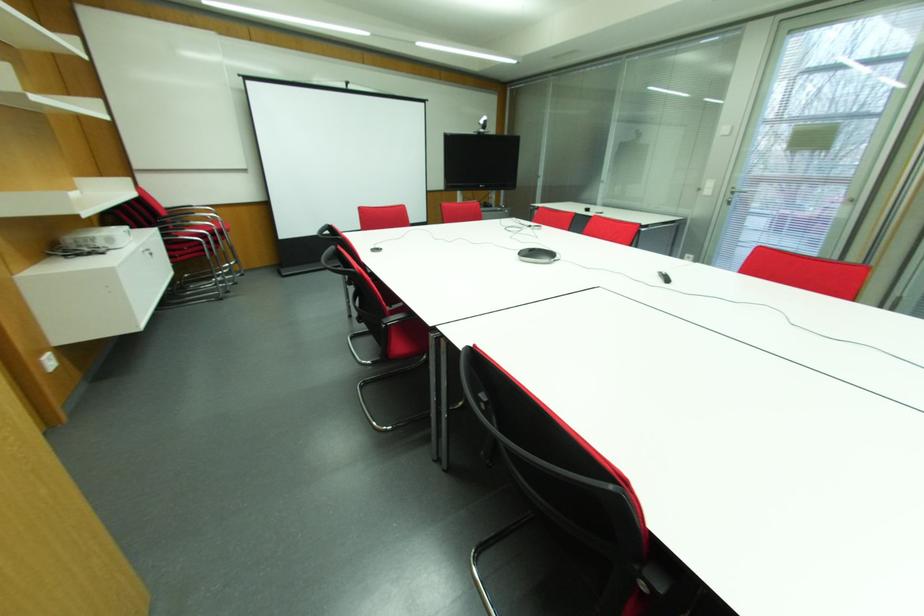
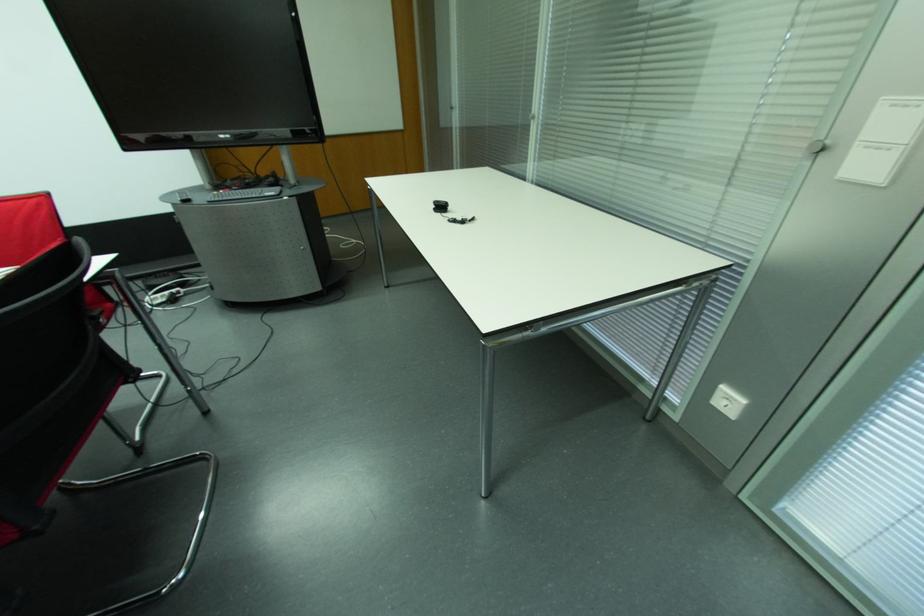
Consider the image. The images are taken continuously from a first-person perspective. In which direction are you moving?

The cameraman walked toward right, forward.